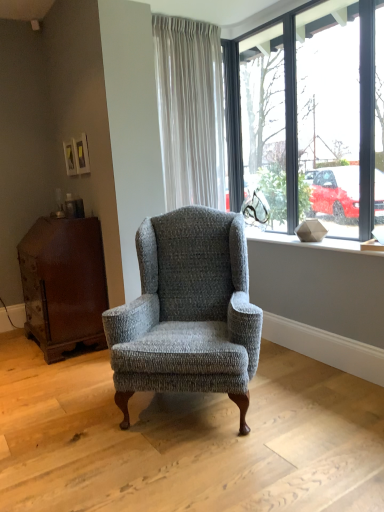
At what (x,y) coordinates should I click in order to perform the action: click on spots to the right of textured gray wingback chair at center. Please return your answer as a coordinate pair (x, y). The width and height of the screenshot is (384, 512). Looking at the image, I should click on (317, 399).